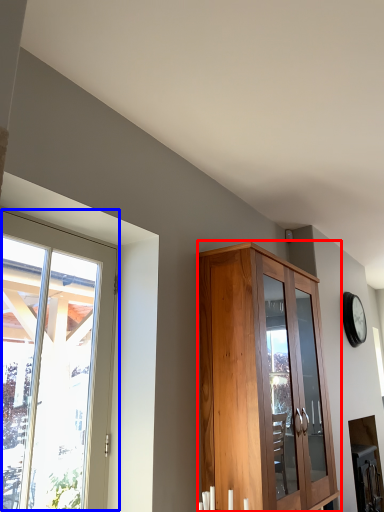
Question: Which object is closer to the camera taking this photo, cupboard (highlighted by a red box) or window (highlighted by a blue box)?

Choices:
 (A) cupboard
 (B) window

Answer: (B)